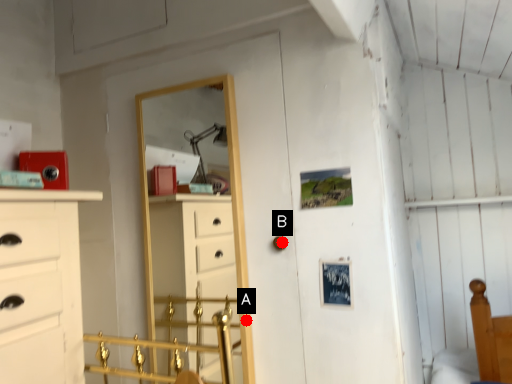
Question: Two points are circled on the image, labeled by A and B beside each circle. Which of the following is the closest to the observer?

Choices:
 (A) A is closer
 (B) B is closer

Answer: (B)